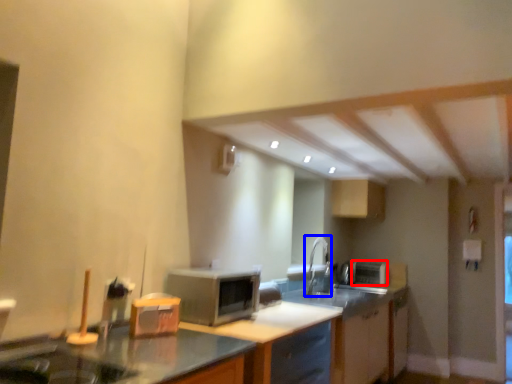
Question: Which of the following is the closest to the observer, appliance (highlighted by a red box) or faucet (highlighted by a blue box)?

Choices:
 (A) appliance
 (B) faucet

Answer: (B)